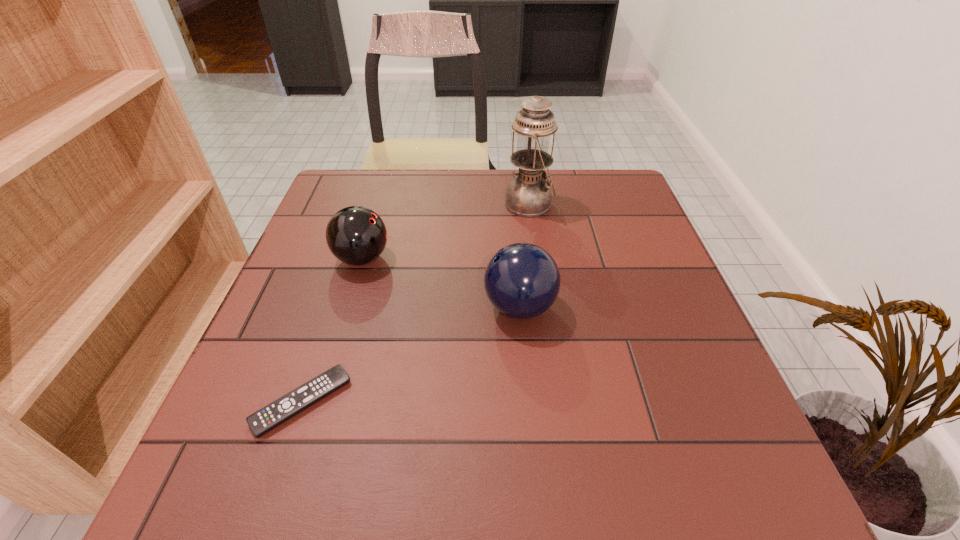
The image size is (960, 540). In order to click on vacant space situated 0.280m on the surface of the nearer bowling ball near the finger holes in this screenshot , I will do (348, 307).

At what (x,y) coordinates should I click in order to perform the action: click on free location located on the surface of the nearer bowling ball near the finger holes. Please return your answer as a coordinate pair (x, y). Looking at the image, I should click on (339, 307).

Where is `vacant space located 0.400m on the surface of the second farthest object near the finger holes`? vacant space located 0.400m on the surface of the second farthest object near the finger holes is located at coordinates (562, 258).

The image size is (960, 540). I want to click on free space located on the back of the shortest object, so click(330, 316).

Identify the location of object at the far edge. This screenshot has height=540, width=960. (528, 195).

Find the location of a particular element. This screenshot has width=960, height=540. bowling ball at the left edge is located at coordinates (356, 235).

Locate an element on the screen. remote control located at the left edge is located at coordinates (274, 414).

You are a GUI agent. You are given a task and a screenshot of the screen. Output one action in this format:
    pyautogui.click(x=<x>, y=<y>)
    Task: Click on the blank space at the far edge of the desktop
    The image size is (960, 540).
    Given the screenshot: What is the action you would take?
    pyautogui.click(x=563, y=189)

Find the location of a particular element. vacant space at the near edge of the desktop is located at coordinates (349, 477).

The height and width of the screenshot is (540, 960). In the image, there is a desktop. In order to click on vacant space at the left edge in this screenshot , I will do `click(329, 272)`.